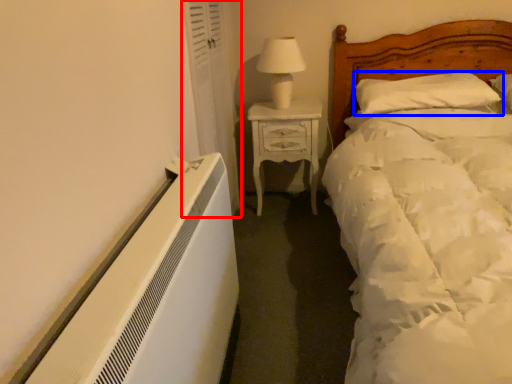
Question: Among these objects, which one is nearest to the camera, curtain (highlighted by a red box) or pillow (highlighted by a blue box)?

Choices:
 (A) curtain
 (B) pillow

Answer: (A)